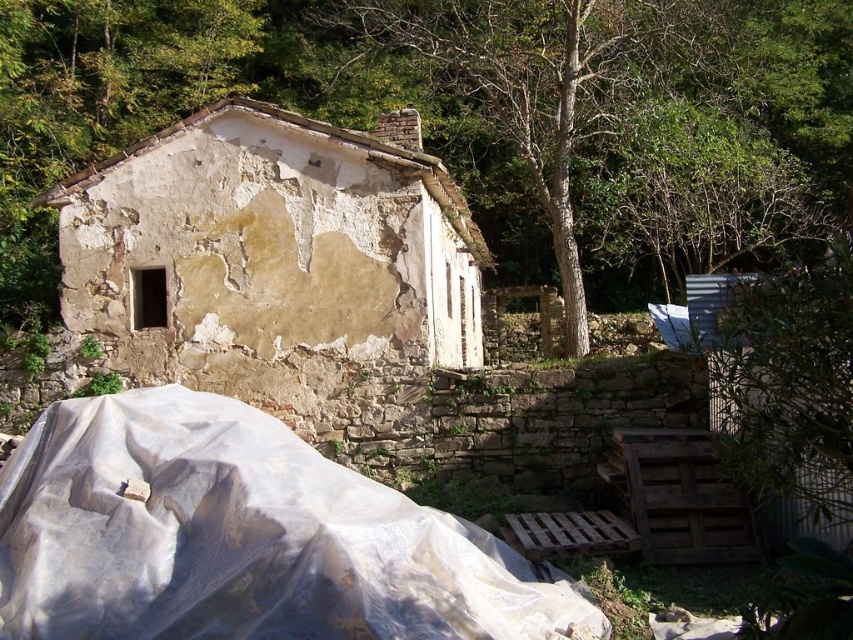
You are a hiker who wants to take a photo of the transparent plastic at lower left and the brown rough bark tree at upper center. Which object should you focus on first if you want both to be in clear focus?

You should focus on the brown rough bark tree at upper center first because it is taller than the transparent plastic at lower left, so focusing on the farther object ensures both are in focus.

You are a contractor assessing the site. You need to know if the transparent plastic at lower left can cover the brown rough bark tree at upper center. Based on their sizes, what do you think?

The transparent plastic at lower left has a smaller width than the brown rough bark tree at upper center, so it cannot fully cover the tree.